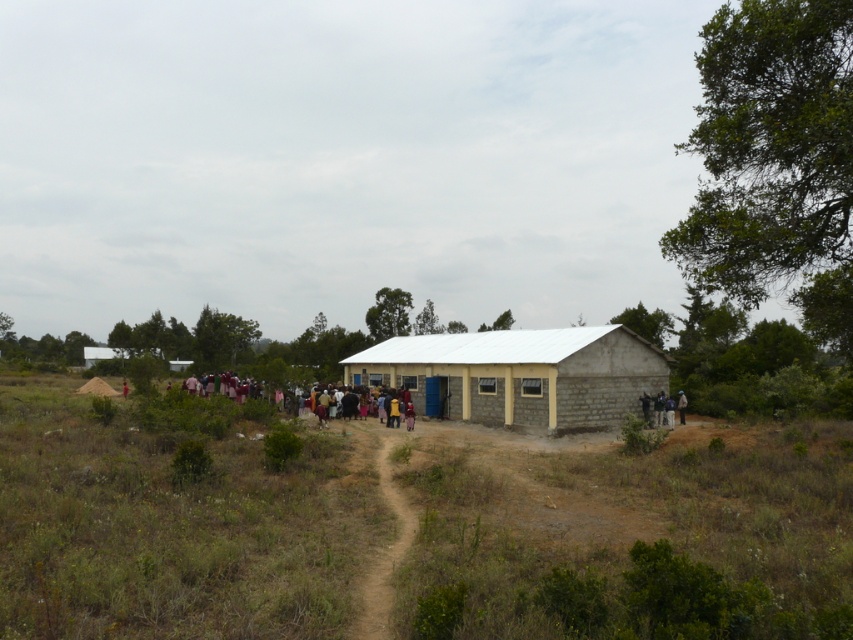
You are a delivery person trying to park your van next to the white corrugated metal hut at center. The van is 2 meters wide. Can you park the van so that it doesn not block the brown dirt track at center?

The white corrugated metal hut at center is wider than the brown dirt track at center. Since the van is 2 meters wide, it may be possible to park it without blocking the track if the track is narrower than the hut. However, without exact measurements, it is uncertain. Please check the actual width of the track and the available space beside the hut.

You are planning to organize a small picnic at the center of the scene. Considering the brown soil at center and the multicolored fabric people at center, which area would be more suitable for placing a picnic blanket?

The brown soil at center has a larger size compared to the multicolored fabric people at center, so it would be more suitable for placing a picnic blanket as there is enough space.